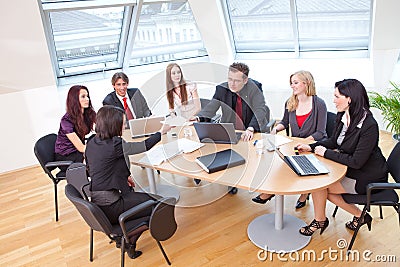
At what (x,y) coordinates should I click in order to perform the action: click on laptop. Please return your answer as a coordinate pair (x, y). The width and height of the screenshot is (400, 267). Looking at the image, I should click on (294, 162), (217, 132), (149, 124).